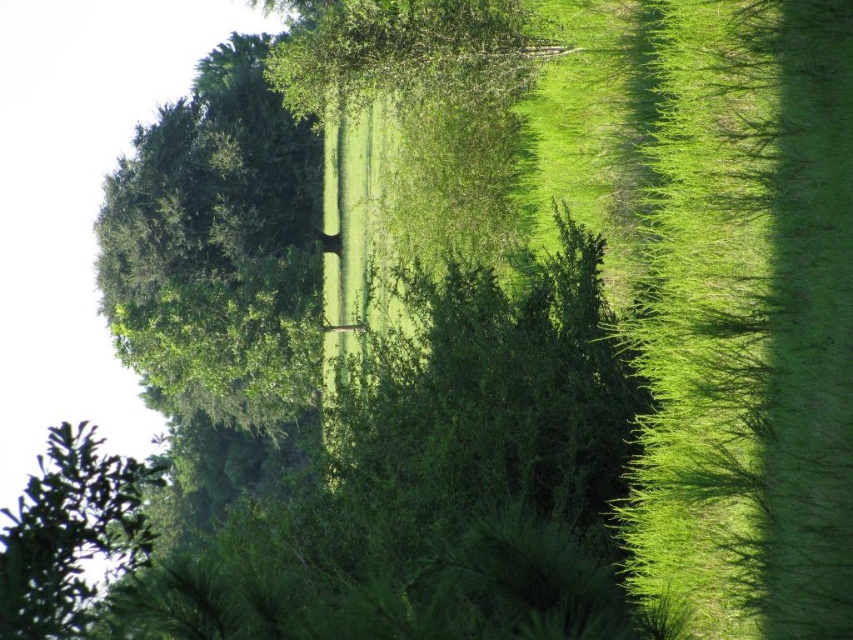
You are a photographer standing at the edge of the garden. You want to take a closeup photo of the green leafy hedge at center. Your camera has a minimum focusing distance of 1.5 meters. Can you take the photo without moving closer?

The distance between the green leafy hedge at center and the camera is 4.47 meters. Since the minimum focusing distance is 1.5 meters, the photographer can take the closeup photo without moving closer because the camera can focus beyond 1.5 meters.

You are a gardener who needs to move a heavy equipment from the green leafy hedge at center to the green leafy tree at upper left. The equipment requires a minimum of 3 meters of clearance to move safely. Based on the scene, can you safely move the equipment between these two points?

The distance between the green leafy hedge at center and the green leafy tree at upper left is 3.43 meters, which is greater than the required 3 meters clearance. Therefore, you can safely move the equipment between these two points.

You are a gardener planning to trim the green leafy hedge at center and the green leafy tree at upper left. Based on their positions, which one do you think is closer to the ground?

The green leafy hedge at center is closer to the ground because it is above the green leafy tree at upper left, meaning the tree is positioned higher up.